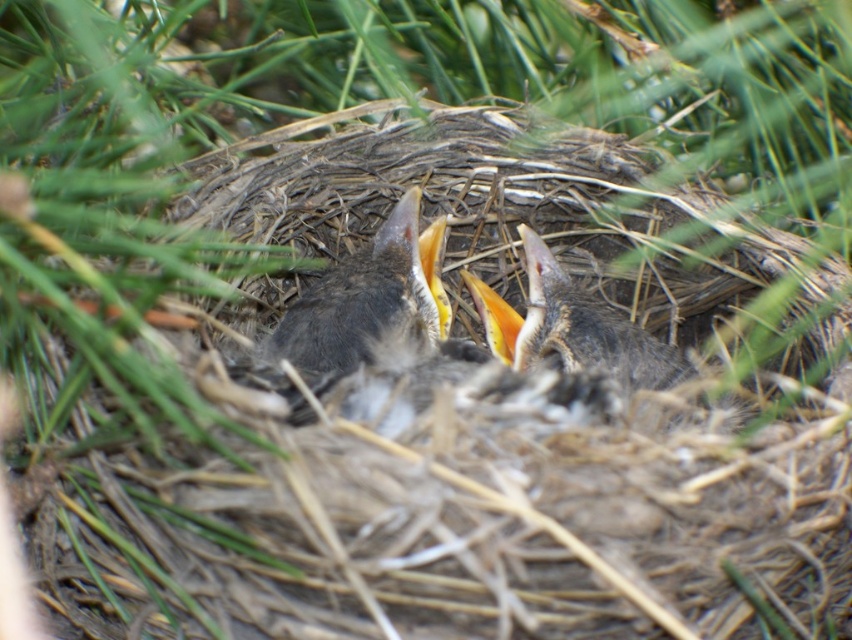
In the scene shown: You are a photographer trying to capture a detailed image of the bird nest. You notice two points in the scene labeled as point (344, 328) and point (660, 364). Which point is closer to your camera lens?

Point (344, 328) is further to the camera than point (660, 364), so the point closer to the camera lens is point (660, 364).

You are a wildlife photographer trying to capture a close shot of the dark gray feathers at center and the soft gray feathers at center in the bird nest. Your camera has a maximum focus range of 7 inches. Can you focus on both feathers simultaneously?

The distance between the dark gray feathers at center and soft gray feathers at center is 7.27 inches. Since your camera can only focus within 7 inches, you cannot focus on both simultaneously as the distance exceeds the maximum focus range.

You are a wildlife researcher observing the baby birds in the nest. You notice two types of feathers on the baby birds at the center of the nest. Which of the two, the dark gray feathers at center or the soft gray feathers at center, is narrower in width?

The dark gray feathers at center is thinner than the soft gray feathers at center, so the dark gray feathers at center is narrower in width.